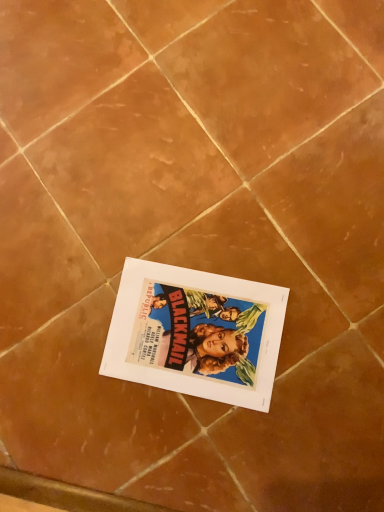
At what (x,y) coordinates should I click in order to perform the action: click on free space to the left of matte paper poster at center. Please return your answer as a coordinate pair (x, y). Looking at the image, I should click on (89, 408).